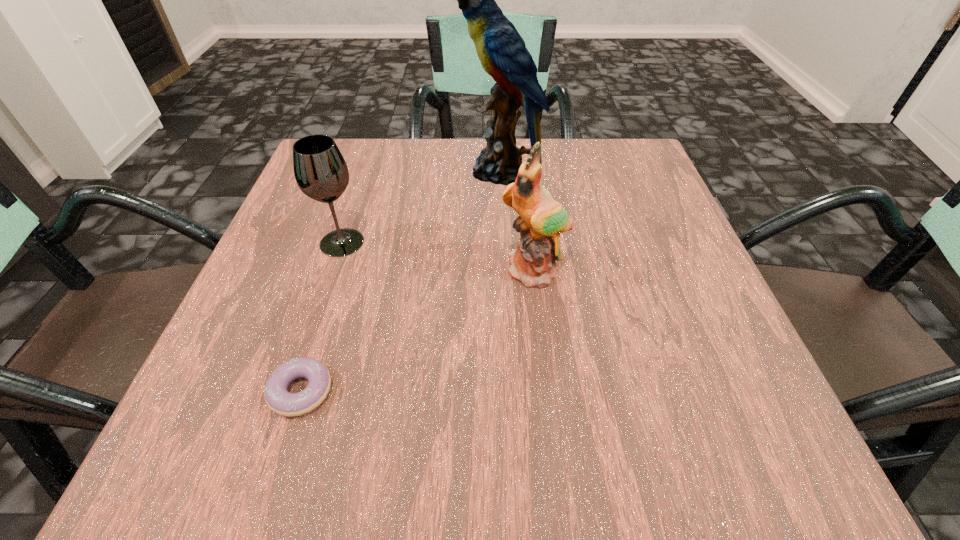
You are a GUI agent. You are given a task and a screenshot of the screen. Output one action in this format:
    pyautogui.click(x=<x>, y=<y>)
    Task: Click on the free space located 0.170m on the front-facing side of the third shortest object
    The height and width of the screenshot is (540, 960).
    Given the screenshot: What is the action you would take?
    pyautogui.click(x=548, y=383)

Locate an element on the screen. The width and height of the screenshot is (960, 540). vacant space located 0.360m on the front of the third tallest object is located at coordinates (270, 462).

The width and height of the screenshot is (960, 540). Identify the location of vacant space situated on the back of the nearest object. (347, 247).

Where is `object at the far edge`? The image size is (960, 540). object at the far edge is located at coordinates (502, 52).

Locate an element on the screen. This screenshot has height=540, width=960. object that is positioned at the near edge is located at coordinates (279, 400).

What are the coordinates of `wineglass located at the left edge` in the screenshot? It's located at (320, 170).

Locate an element on the screen. doughnut that is at the left edge is located at coordinates (279, 400).

I want to click on object that is at the near left corner, so pyautogui.click(x=279, y=400).

Find the location of a particular element. Image resolution: width=960 pixels, height=540 pixels. vacant space at the far edge of the desktop is located at coordinates (557, 192).

Where is `blank space at the near edge`? The image size is (960, 540). blank space at the near edge is located at coordinates (558, 470).